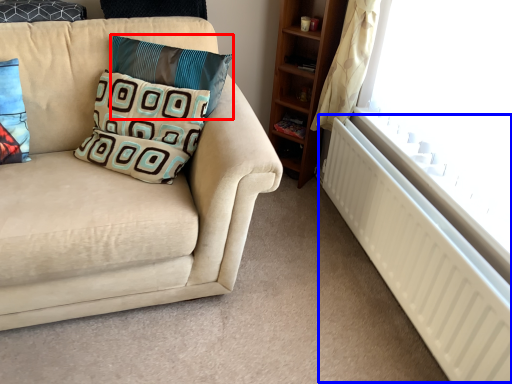
Question: Which of the following is the closest to the observer, pillow (highlighted by a red box) or radiator (highlighted by a blue box)?

Choices:
 (A) pillow
 (B) radiator

Answer: (B)